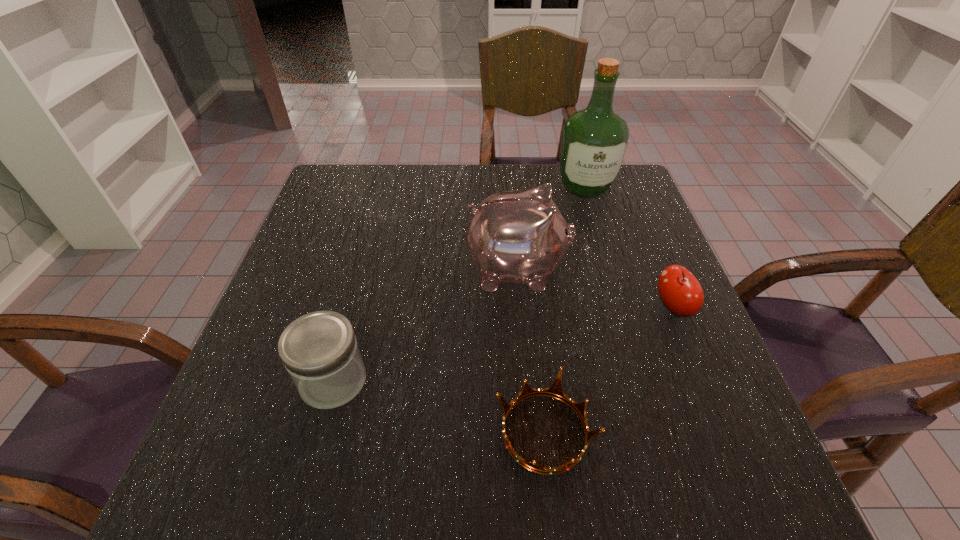
The width and height of the screenshot is (960, 540). Find the location of `free spot located 0.220m on the right of the shortest object`. free spot located 0.220m on the right of the shortest object is located at coordinates (724, 432).

Where is `object that is at the far edge`? object that is at the far edge is located at coordinates (594, 141).

Locate an element on the screen. This screenshot has height=540, width=960. object at the near edge is located at coordinates pyautogui.click(x=555, y=390).

Find the location of `object that is at the left edge`. object that is at the left edge is located at coordinates (320, 352).

At what (x,y) coordinates should I click in order to perform the action: click on liquor situated at the right edge. Please return your answer as a coordinate pair (x, y). The image size is (960, 540). Looking at the image, I should click on (594, 141).

Identify the location of apple that is at the right edge. This screenshot has width=960, height=540. (679, 290).

Locate an element on the screen. The image size is (960, 540). object present at the far right corner is located at coordinates (594, 141).

The height and width of the screenshot is (540, 960). In order to click on vacant area at the far edge of the desktop in this screenshot , I will do `click(577, 198)`.

Image resolution: width=960 pixels, height=540 pixels. Find the location of `free spot at the left edge of the desktop`. free spot at the left edge of the desktop is located at coordinates (296, 309).

At what (x,y) coordinates should I click in order to perform the action: click on vacant region at the right edge of the desktop. Please return your answer as a coordinate pair (x, y). Looking at the image, I should click on (620, 224).